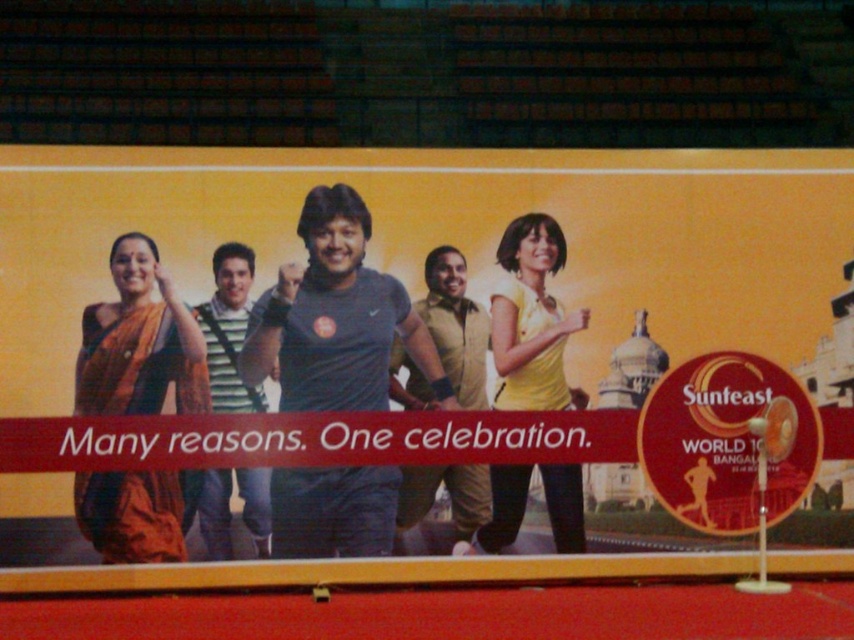
Question: Which of these objects is positioned farthest from the gray matte t-shirt at center?

Choices:
 (A) matte gray t-shirt at center
 (B) tan suede vest at center

Answer: (A)

Question: Can you confirm if matte gray t-shirt at center is thinner than tan suede vest at center?

Choices:
 (A) no
 (B) yes

Answer: (A)

Question: Can you confirm if tan suede vest at center is positioned below striped cotton shirt at center?

Choices:
 (A) no
 (B) yes

Answer: (B)

Question: Which point is farther from the camera taking this photo?

Choices:
 (A) (326, 472)
 (B) (227, 273)

Answer: (A)

Question: Does matte orange saree at left appear on the right side of yellow matte dress at center?

Choices:
 (A) yes
 (B) no

Answer: (B)

Question: Which point appears farthest from the camera in this image?

Choices:
 (A) (354, 227)
 (B) (250, 264)
 (C) (665, 272)

Answer: (C)